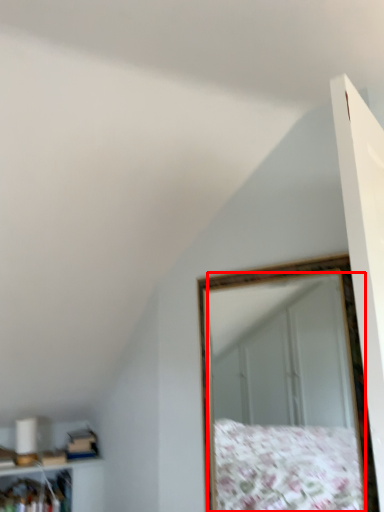
Question: Considering the relative positions of mirror (annotated by the red box) and cabinet in the image provided, where is mirror (annotated by the red box) located with respect to the staircase?

Choices:
 (A) left
 (B) right

Answer: (B)